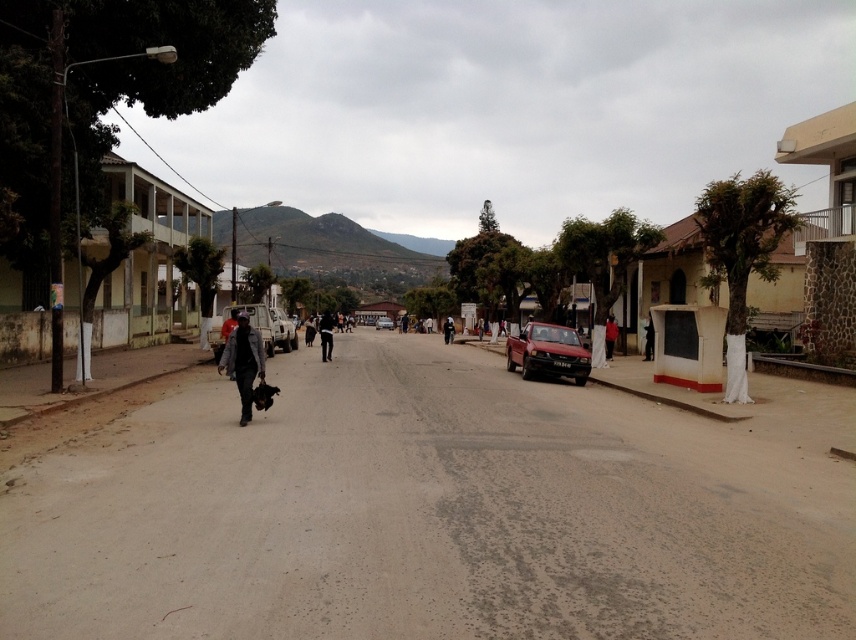
You are standing on the quiet street scene and want to walk towards the two points marked in the image. Which point, point (597, 392) or point (541, 339), will you reach first?

Point (597, 392) is closer to the viewer than point (541, 339), so you will reach point (597, 392) first.